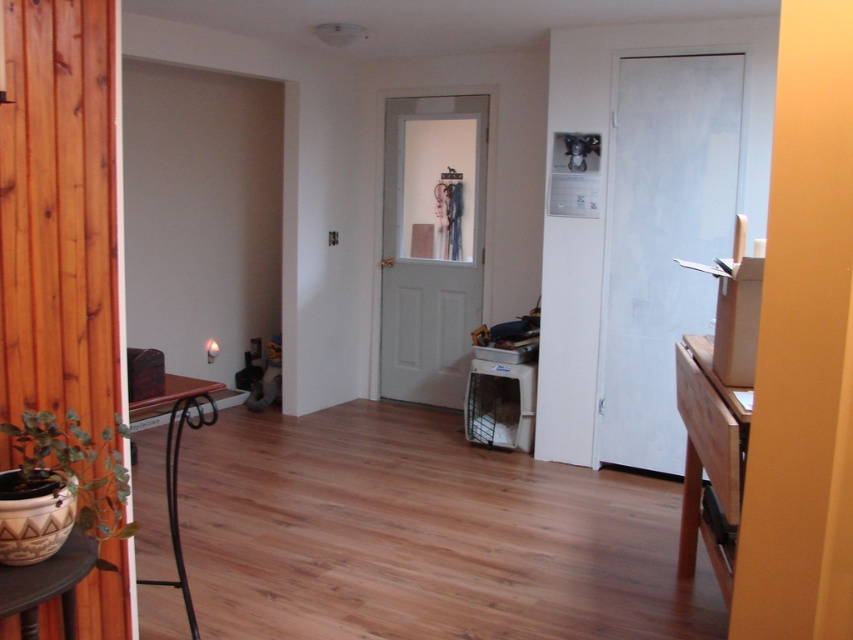
Question: Is light brown wood table at right bigger than brown matte hardwood at left?

Choices:
 (A) no
 (B) yes

Answer: (A)

Question: Which point is closer to the camera taking this photo?

Choices:
 (A) (177, 522)
 (B) (701, 481)

Answer: (A)

Question: Can you confirm if light brown wood table at right is wider than brown matte hardwood at left?

Choices:
 (A) yes
 (B) no

Answer: (B)

Question: Which is nearer to the light brown wood table at right?

Choices:
 (A) brown matte hardwood at left
 (B) matte plastic stool at lower center

Answer: (B)

Question: Can you confirm if light brown wood table at right is wider than brown matte hardwood at left?

Choices:
 (A) no
 (B) yes

Answer: (A)

Question: Which object is the farthest from the brown matte hardwood at left?

Choices:
 (A) light brown wood table at right
 (B) matte plastic stool at lower center

Answer: (A)